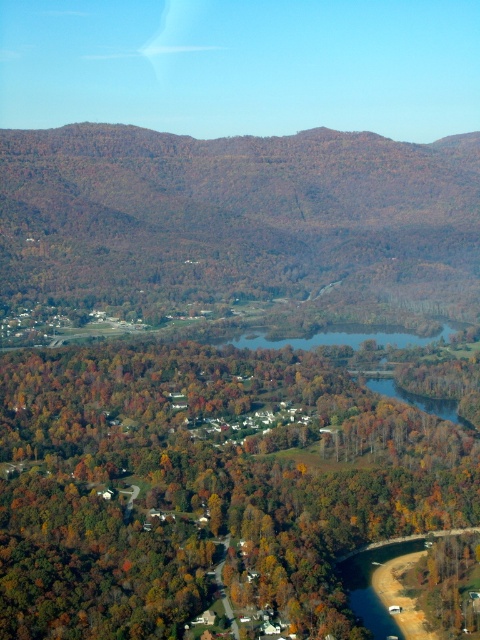
You are a hiker standing at the base of the green matte tree at center and want to reach the brown textured mountain at upper left. Based on the scene, which direction should you head to move towards the mountain?

The green matte tree at center is located below the brown textured mountain at upper left, so you should head north or upwards to reach the mountain.

Based on the photo, you are a drone operator flying over a rural area during autumn. Your drone is currently at the center of the image. You need to locate the green matte tree at center. According to the coordinates provided, in which direction should you move your drone to find it?

The green matte tree at center is located at coordinates point (204, 484). Since the drone is at the center of the image, which is point (240, 320), you should move the drone northeast to reach the green matte tree at center.